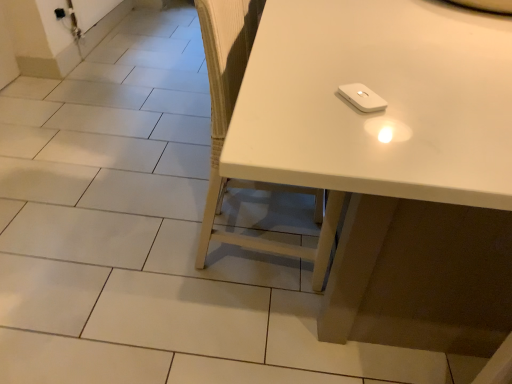
Question: Are white glossy table at upper right and white matte chair at center beside each other?

Choices:
 (A) yes
 (B) no

Answer: (B)

Question: Can you confirm if white glossy table at upper right is shorter than white matte chair at center?

Choices:
 (A) yes
 (B) no

Answer: (A)

Question: Is the position of white glossy table at upper right less distant than that of white matte chair at center?

Choices:
 (A) yes
 (B) no

Answer: (A)

Question: Is white glossy table at upper right to the left of white matte chair at center from the viewer's perspective?

Choices:
 (A) yes
 (B) no

Answer: (B)

Question: From a real-world perspective, is white glossy table at upper right on top of white matte chair at center?

Choices:
 (A) yes
 (B) no

Answer: (B)

Question: Is white glossy table at upper right surrounding white matte chair at center?

Choices:
 (A) yes
 (B) no

Answer: (A)

Question: Is white matte wii controller at upper center oriented towards white glossy table at upper right?

Choices:
 (A) no
 (B) yes

Answer: (B)

Question: Considering the relative sizes of white matte wii controller at upper center and white glossy table at upper right in the image provided, is white matte wii controller at upper center wider than white glossy table at upper right?

Choices:
 (A) no
 (B) yes

Answer: (A)

Question: Considering the relative positions of white matte wii controller at upper center and white glossy table at upper right in the image provided, is white matte wii controller at upper center in front of white glossy table at upper right?

Choices:
 (A) yes
 (B) no

Answer: (B)

Question: From the image's perspective, is white matte wii controller at upper center under white glossy table at upper right?

Choices:
 (A) no
 (B) yes

Answer: (B)

Question: Is white matte wii controller at upper center looking in the opposite direction of white glossy table at upper right?

Choices:
 (A) no
 (B) yes

Answer: (B)

Question: From a real-world perspective, is white matte wii controller at upper center under white glossy table at upper right?

Choices:
 (A) no
 (B) yes

Answer: (A)

Question: Is the position of white matte chair at center more distant than that of white matte wii controller at upper center?

Choices:
 (A) yes
 (B) no

Answer: (A)